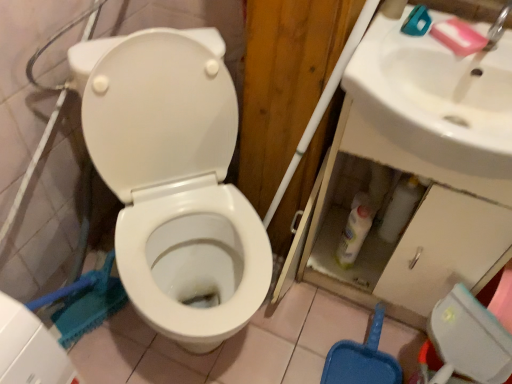
Measure the distance between white glossy sink at upper right and camera.

white glossy sink at upper right is 28.25 inches from camera.

Identify the location of white glossy sink at upper right. (435, 98).

Identify the location of white glossy toilet at center. (174, 180).

From a real-world perspective, is white glossy sink at upper right positioned under white glossy toilet at center based on gravity?

No, from a real-world perspective, white glossy sink at upper right is not below white glossy toilet at center.

Is the position of white glossy sink at upper right more distant than that of white glossy toilet at center?

Yes.

Which is in front, point (460, 61) or point (100, 51)?

The point (460, 61) is in front.

Can you confirm if white glossy toilet at center is taller than white glossy sink at upper right?

Indeed, white glossy toilet at center has a greater height compared to white glossy sink at upper right.

Is white glossy toilet at center spatially inside white glossy sink at upper right, or outside of it?

white glossy toilet at center lies outside white glossy sink at upper right.

Which is more to the left, white glossy toilet at center or white glossy sink at upper right?

Positioned to the left is white glossy toilet at center.

In terms of size, does white glossy toilet at center appear bigger or smaller than white glossy sink at upper right?

Result: In the image, white glossy toilet at center appears to be larger than white glossy sink at upper right.

Consider the image. Between pink matte soap at upper right and white glossy bottle at lower center, which one has larger width?

With larger width is pink matte soap at upper right.

Visually, is pink matte soap at upper right positioned to the left or to the right of white glossy bottle at lower center?

Based on their positions, pink matte soap at upper right is located to the right of white glossy bottle at lower center.

Between pink matte soap at upper right and white glossy bottle at lower center, which one has smaller size?

With smaller size is pink matte soap at upper right.

Does pink matte soap at upper right come in front of white glossy bottle at lower center?

Yes, pink matte soap at upper right is closer to the camera.

Based on their positions, is pink matte soap at upper right located to the left or right of white glossy sink at upper right?

In the image, pink matte soap at upper right appears on the right side of white glossy sink at upper right.

Find the location of a particular element. sink below the pink matte soap at upper right (from the image's perspective) is located at coordinates (435, 98).

Which of these two, pink matte soap at upper right or white glossy sink at upper right, is wider?

Wider between the two is white glossy sink at upper right.

From the image's perspective, is pink matte soap at upper right located beneath white glossy sink at upper right?

No, from the image's perspective, pink matte soap at upper right is not beneath white glossy sink at upper right.

Can you confirm if white glossy sink at upper right is thinner than white glossy bottle at lower center?

In fact, white glossy sink at upper right might be wider than white glossy bottle at lower center.

What are the coordinates of `bottle behind the white glossy sink at upper right` in the screenshot? It's located at (354, 234).

Would you consider white glossy sink at upper right to be distant from white glossy bottle at lower center?

They are positioned close to each other.

Is white glossy sink at upper right positioned behind white glossy bottle at lower center?

No.

Does white glossy bottle at lower center touch white glossy sink at upper right?

No, white glossy bottle at lower center is not beside white glossy sink at upper right.

Is white glossy bottle at lower center in front of or behind white glossy sink at upper right in the image?

Clearly, white glossy bottle at lower center is behind white glossy sink at upper right.

In order to click on sink above the white glossy bottle at lower center (from a real-world perspective) in this screenshot , I will do (435, 98).

Is white glossy bottle at lower center facing away from white glossy sink at upper right?

That's not correct — white glossy bottle at lower center is not looking away from white glossy sink at upper right.

Which is behind, point (337, 252) or point (190, 280)?

Point (337, 252)

From a real-world perspective, is white glossy bottle at lower center located higher than white glossy toilet at center?

Actually, white glossy bottle at lower center is physically below white glossy toilet at center in the real world.

Between white glossy bottle at lower center and white glossy toilet at center, which one has less height?

white glossy bottle at lower center.

Image resolution: width=512 pixels, height=384 pixels. What are the coordinates of `toilet on the left of white glossy sink at upper right` in the screenshot? It's located at (174, 180).

At what (x,y) coordinates should I click in order to perform the action: click on toilet below the white glossy sink at upper right (from a real-world perspective). Please return your answer as a coordinate pair (x, y). Looking at the image, I should click on (174, 180).

Considering their positions, is white glossy toilet at center positioned closer to white glossy sink at upper right than pink matte soap at upper right?

Among the two, pink matte soap at upper right is located nearer to white glossy sink at upper right.

Estimate the real-world distances between objects in this image. Which object is closer to pink matte soap at upper right, white glossy toilet at center or white glossy sink at upper right?

white glossy sink at upper right is positioned closer to the anchor pink matte soap at upper right.

Estimate the real-world distances between objects in this image. Which object is further from white glossy toilet at center, white glossy sink at upper right or white glossy bottle at lower center?

white glossy bottle at lower center is positioned further to the anchor white glossy toilet at center.

Looking at the image, which one is located further to white glossy sink at upper right, white glossy bottle at lower center or pink matte soap at upper right?

Among the two, white glossy bottle at lower center is located further to white glossy sink at upper right.

From the image, which object appears to be farther from white glossy toilet at center, white glossy bottle at lower center or pink matte soap at upper right?

pink matte soap at upper right lies further to white glossy toilet at center than the other object.

Considering their positions, is white glossy sink at upper right positioned closer to white glossy toilet at center than pink matte soap at upper right?

white glossy sink at upper right is positioned closer to the anchor white glossy toilet at center.

Which object lies nearer to the anchor point white glossy sink at upper right, white glossy toilet at center or white glossy bottle at lower center?

white glossy bottle at lower center lies closer to white glossy sink at upper right than the other object.

Considering their positions, is white glossy bottle at lower center positioned further to pink matte soap at upper right than white glossy sink at upper right?

white glossy bottle at lower center is further to pink matte soap at upper right.

Where is `bottle between white glossy toilet at center and pink matte soap at upper right from left to right`? The image size is (512, 384). bottle between white glossy toilet at center and pink matte soap at upper right from left to right is located at coordinates (354, 234).

Where is `sink between white glossy toilet at center and pink matte soap at upper right from left to right`? The image size is (512, 384). sink between white glossy toilet at center and pink matte soap at upper right from left to right is located at coordinates (435, 98).

Where is `sink positioned between white glossy toilet at center and white glossy bottle at lower center from near to far`? Image resolution: width=512 pixels, height=384 pixels. sink positioned between white glossy toilet at center and white glossy bottle at lower center from near to far is located at coordinates (435, 98).

Where is `soap between white glossy sink at upper right and white glossy bottle at lower center in the front-back direction`? soap between white glossy sink at upper right and white glossy bottle at lower center in the front-back direction is located at coordinates (458, 37).